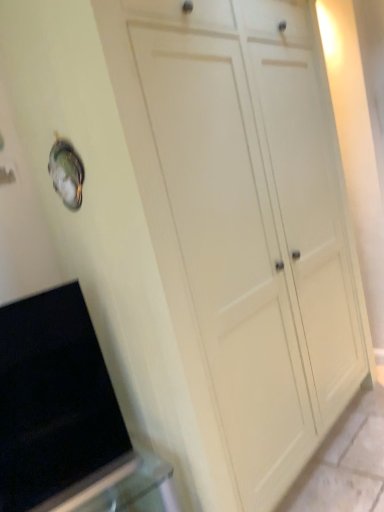
Question: Is black matte oven at lower left situated inside white matte cupboard at center or outside?

Choices:
 (A) inside
 (B) outside

Answer: (B)

Question: Looking at the image, does black matte oven at lower left seem bigger or smaller compared to white matte cupboard at center?

Choices:
 (A) big
 (B) small

Answer: (B)

Question: Considering the positions of point (54, 394) and point (291, 81), is point (54, 394) closer or farther from the camera than point (291, 81)?

Choices:
 (A) closer
 (B) farther

Answer: (A)

Question: From a real-world perspective, is white matte cupboard at center positioned above or below black matte oven at lower left?

Choices:
 (A) below
 (B) above

Answer: (B)

Question: From their relative heights in the image, would you say white matte cupboard at center is taller or shorter than black matte oven at lower left?

Choices:
 (A) short
 (B) tall

Answer: (B)

Question: Is white matte cupboard at center inside the boundaries of black matte oven at lower left, or outside?

Choices:
 (A) inside
 (B) outside

Answer: (B)

Question: Would you say white matte cupboard at center is to the left or to the right of black matte oven at lower left in the picture?

Choices:
 (A) right
 (B) left

Answer: (A)